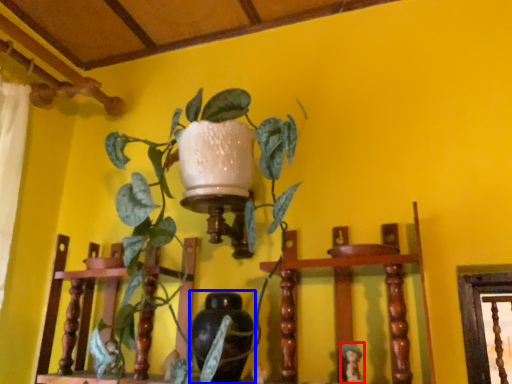
Question: Which point is further to the camera, toy (highlighted by a red box) or vase (highlighted by a blue box)?

Choices:
 (A) toy
 (B) vase

Answer: (B)